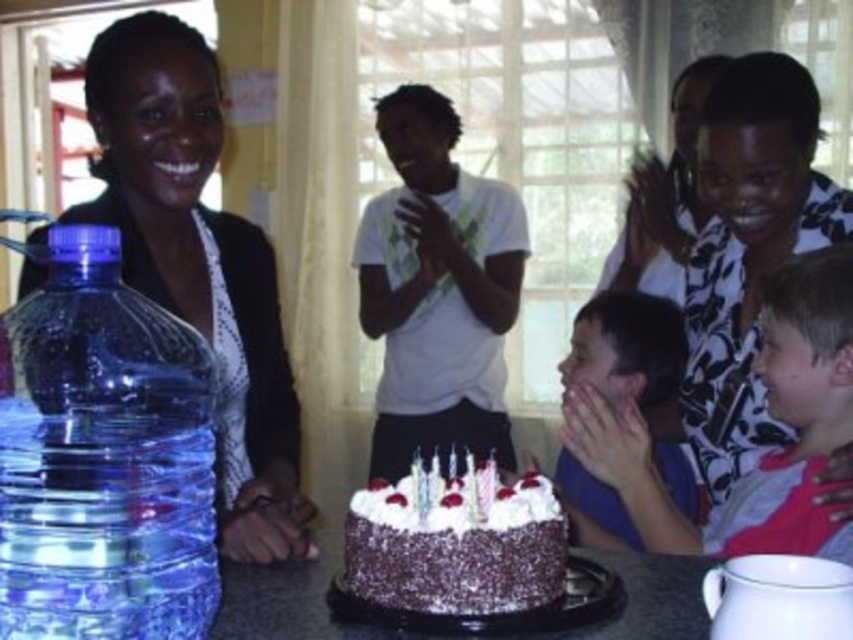
Is point (792, 147) closer to camera compared to point (515, 586)?

No, it is behind (515, 586).

Does white floral shirt at upper right have a larger size compared to chocolate frosted cake at center?

Yes.

Is point (708, 234) farther from camera compared to point (378, 525)?

Yes, it is.

At what (x,y) coordinates should I click in order to perform the action: click on white floral shirt at upper right. Please return your answer as a coordinate pair (x, y). Looking at the image, I should click on (747, 250).

Is transparent plastic water bottle at left positioned in front of pink fabric shirt at right?

Yes, it is in front of pink fabric shirt at right.

Between point (155, 157) and point (763, 294), which one is positioned in front?

Point (155, 157)

Where is `transparent plastic water bottle at left`? The height and width of the screenshot is (640, 853). transparent plastic water bottle at left is located at coordinates (199, 264).

Does transparent plastic bottle at left have a smaller size compared to pink fabric shirt at right?

Yes.

I want to click on transparent plastic bottle at left, so click(x=103, y=458).

At what (x,y) coordinates should I click in order to perform the action: click on transparent plastic bottle at left. Please return your answer as a coordinate pair (x, y). Image resolution: width=853 pixels, height=640 pixels. Looking at the image, I should click on (103, 458).